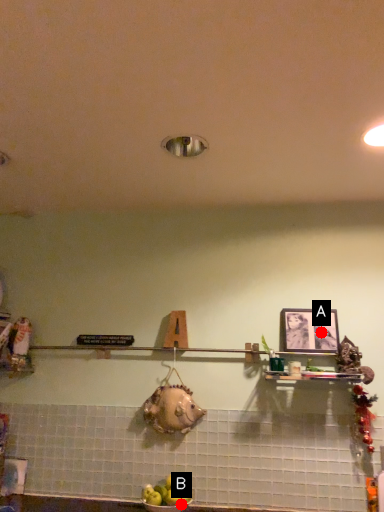
Question: Two points are circled on the image, labeled by A and B beside each circle. Which point is farther to the camera?

Choices:
 (A) A is further
 (B) B is further

Answer: (A)